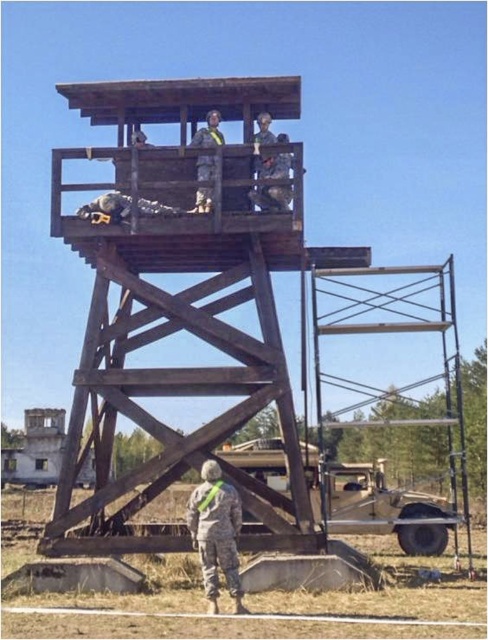
Which is in front, point (205, 506) or point (217, 145)?

Point (205, 506) is in front.

Between camouflage fabric uniform at lower center and camouflage fabric uniform at center, which one appears on the left side from the viewer's perspective?

camouflage fabric uniform at center is more to the left.

Describe the element at coordinates (216, 532) in the screenshot. The width and height of the screenshot is (488, 640). I see `camouflage fabric uniform at lower center` at that location.

At what (x,y) coordinates should I click in order to perform the action: click on camouflage fabric uniform at lower center. Please return your answer as a coordinate pair (x, y). Looking at the image, I should click on (216, 532).